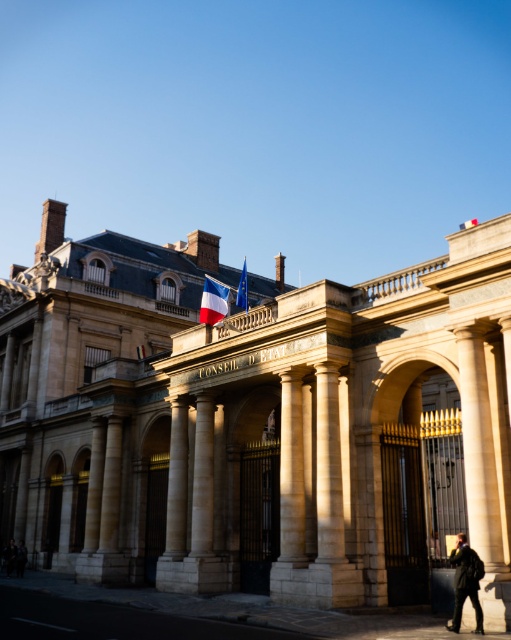
Question: Which object appears farthest from the camera in this image?

Choices:
 (A) stone building at center
 (B) smooth stone pillar at center
 (C) dark gray jacket at lower right

Answer: (B)

Question: Does smooth stone pillar at center have a larger size compared to dark gray jacket at lower right?

Choices:
 (A) no
 (B) yes

Answer: (B)

Question: Among these objects, which one is nearest to the camera?

Choices:
 (A) stone building at center
 (B) blue fabric flag at center
 (C) blue-white-red fabric flag at center
 (D) smooth stone pillar at center

Answer: (A)

Question: Can you confirm if stone building at center is positioned to the left of dark gray jacket at lower right?

Choices:
 (A) yes
 (B) no

Answer: (A)

Question: Can you confirm if smooth stone pillar at center is positioned below blue-white-red fabric flag at center?

Choices:
 (A) yes
 (B) no

Answer: (A)

Question: Which object is the closest to the dark gray jacket at lower right?

Choices:
 (A) blue fabric flag at center
 (B) blue-white-red fabric flag at center
 (C) stone building at center
 (D) smooth stone pillar at center

Answer: (D)